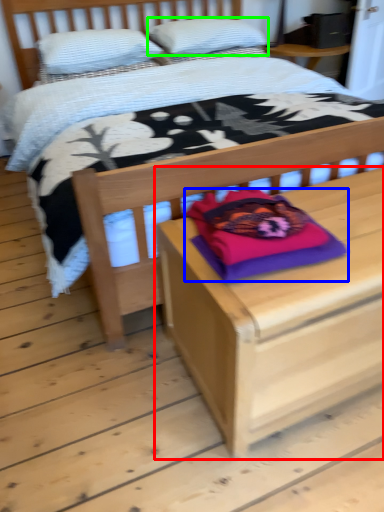
Question: Which object is the closest to the nightstand (highlighted by a red box)? Choose among these: pillow (highlighted by a blue box) or pillow (highlighted by a green box).

Choices:
 (A) pillow
 (B) pillow

Answer: (A)